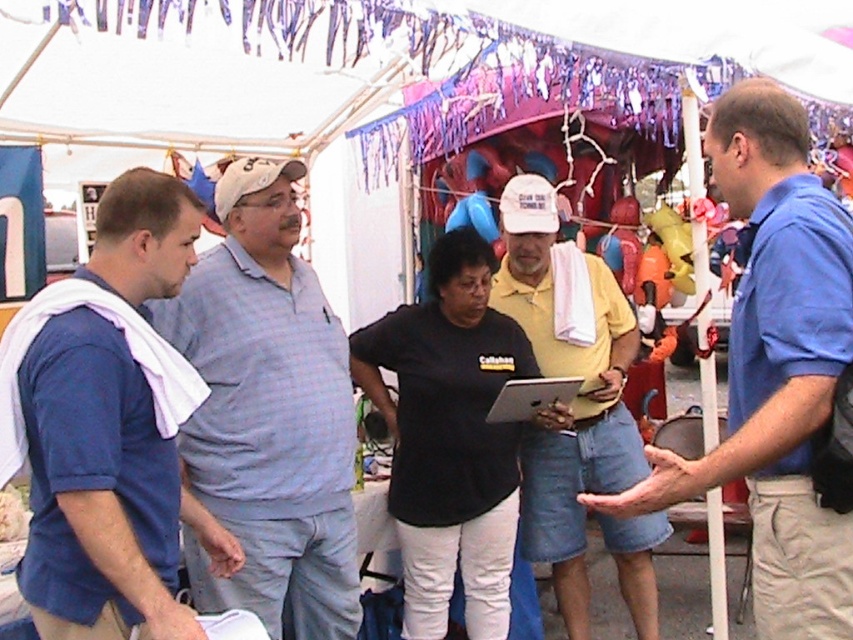
You are a photographer at the fair trying to capture a candid shot of the people under the tent. You notice the light blue plaid shirt at center and the black matte shirt at center. Which one is closer to your camera lens?

The light blue plaid shirt at center is closer to your camera lens because it is in front of the black matte shirt at center.

In the scene shown: You are standing at the point marked as point (268, 412) in the image. What is the color of the shirt you are standing on?

The point (268, 412) is on the light blue plaid shirt at center, so the shirt is light blue plaid.

You are standing at the center of the image and want to greet the person wearing the blue cotton shirt at left. In which direction should you move to approach them?

The blue cotton shirt at left is located at point 0.667 on the x axis and 0.128 on the y axis. Since you are at the center, you should move to the left to approach the blue cotton shirt at left.